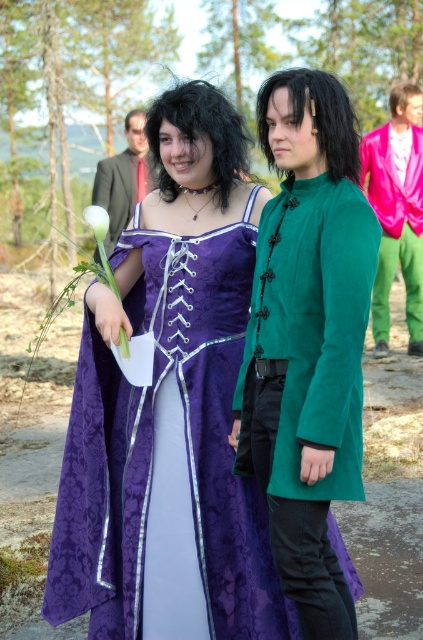
Is the position of pink shiny jacket at upper right more distant than that of green matte flower at center?

Yes, it is behind green matte flower at center.

Which is below, pink shiny jacket at upper right or green matte flower at center?

green matte flower at center is lower down.

Identify the location of pink shiny jacket at upper right. The image size is (423, 640). (397, 211).

Does purple satin dress at center come in front of matte green coat at center?

Yes, purple satin dress at center is closer to the viewer.

Based on the photo, who is taller, purple satin dress at center or matte green coat at center?

With more height is matte green coat at center.

Where is `purple satin dress at center`? purple satin dress at center is located at coordinates click(x=77, y=500).

Does satin purple dress at center lie behind purple satin dress at center?

No, satin purple dress at center is closer to the viewer.

Who is positioned more to the left, satin purple dress at center or purple satin dress at center?

purple satin dress at center is more to the left.

Who is more distant from viewer, (282,140) or (90,515)?

Point (90,515)

The width and height of the screenshot is (423, 640). I want to click on satin purple dress at center, so click(x=307, y=339).